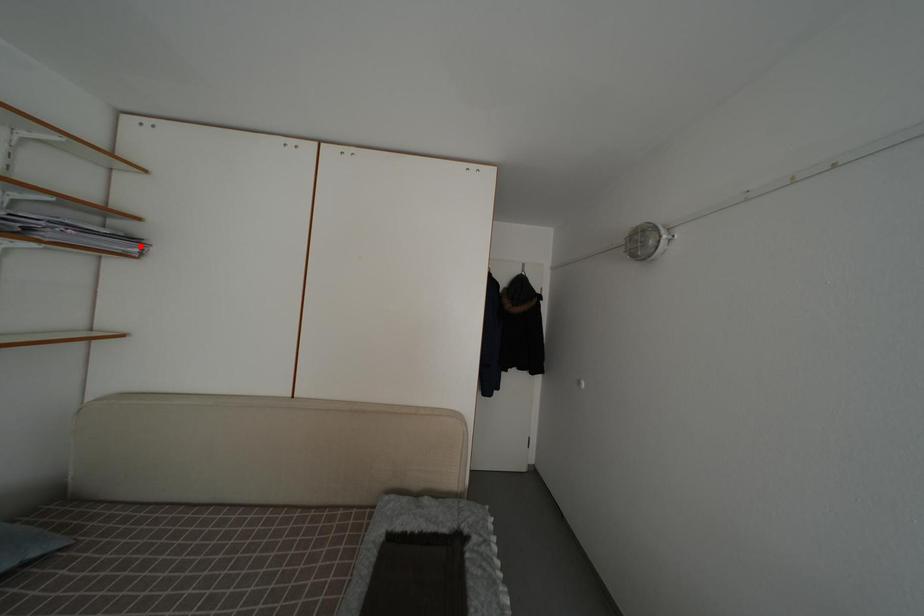
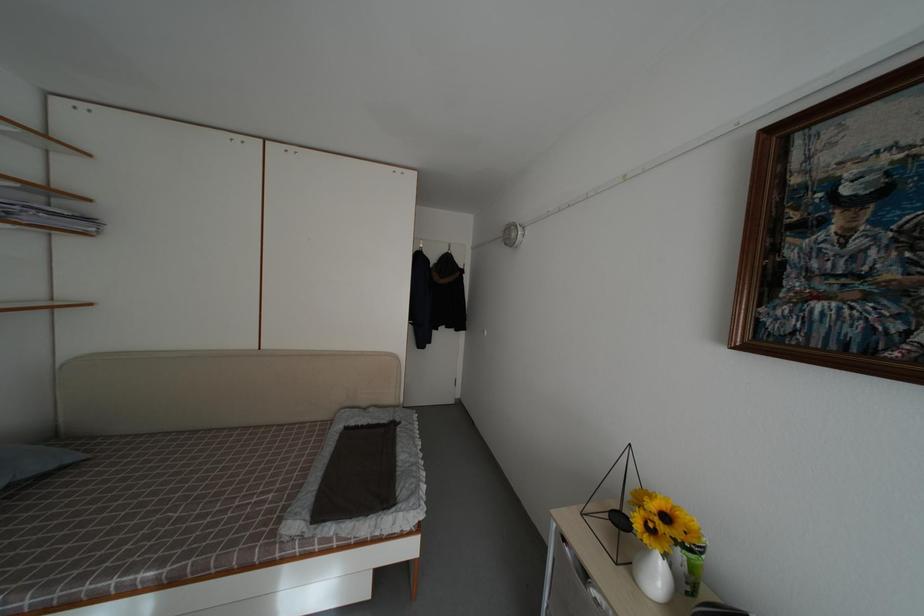
In the second image, find the point that corresponds to the highlighted location in the first image.

(94, 225)